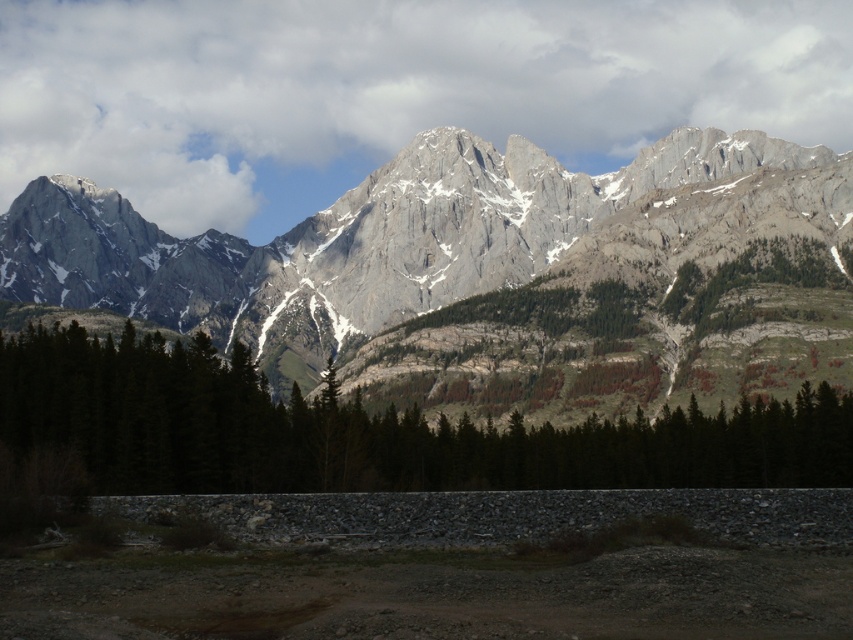
You are an environmental scientist analyzing the landscape. You observe the gray rocky mountain range at upper center and the green matte trees at center. Which object would cast a longer shadow during midday when the sun is directly overhead?

The gray rocky mountain range at upper center is larger in size than the green matte trees at center, so it would cast a longer shadow during midday when the sun is directly overhead.

You are standing at the point marked by the coordinates point [505,275] in the image. Looking around, what large natural feature do you see directly in front of you?

The point [505,275] marks the gray rocky mountain range at upper center, so directly in front of you would be the gray rocky mountain range at upper center.